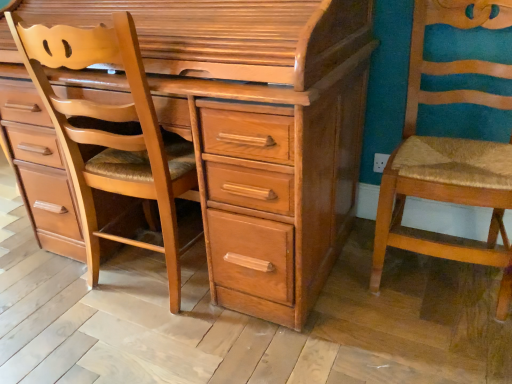
Question: Is light brown wood chest of drawers at center facing away from wooden textured chair at right?

Choices:
 (A) no
 (B) yes

Answer: (A)

Question: From a real-world perspective, is light brown wood chest of drawers at center below wooden textured chair at right?

Choices:
 (A) yes
 (B) no

Answer: (B)

Question: Is light brown wood chest of drawers at center surrounding wooden textured chair at right?

Choices:
 (A) no
 (B) yes

Answer: (A)

Question: Could you tell me if light brown wood chest of drawers at center is facing wooden textured chair at right?

Choices:
 (A) yes
 (B) no

Answer: (B)

Question: Is light brown wood chest of drawers at center to the left of wooden textured chair at right from the viewer's perspective?

Choices:
 (A) no
 (B) yes

Answer: (B)

Question: Is light brown wood chest of drawers at center in contact with wooden textured chair at right?

Choices:
 (A) yes
 (B) no

Answer: (B)

Question: Would you say light brown wood chair at left is part of wooden textured chair at right's contents?

Choices:
 (A) yes
 (B) no

Answer: (B)

Question: From the image's perspective, is wooden textured chair at right on top of light brown wood chair at left?

Choices:
 (A) yes
 (B) no

Answer: (A)

Question: Is wooden textured chair at right oriented away from light brown wood chair at left?

Choices:
 (A) no
 (B) yes

Answer: (A)

Question: From the image's perspective, is wooden textured chair at right beneath light brown wood chair at left?

Choices:
 (A) yes
 (B) no

Answer: (B)

Question: Considering the relative sizes of wooden textured chair at right and light brown wood chair at left in the image provided, is wooden textured chair at right shorter than light brown wood chair at left?

Choices:
 (A) no
 (B) yes

Answer: (B)

Question: From a real-world perspective, is wooden textured chair at right located higher than light brown wood chair at left?

Choices:
 (A) no
 (B) yes

Answer: (A)

Question: Is the depth of light brown wood chair at left greater than that of light brown wood chest of drawers at center?

Choices:
 (A) yes
 (B) no

Answer: (A)